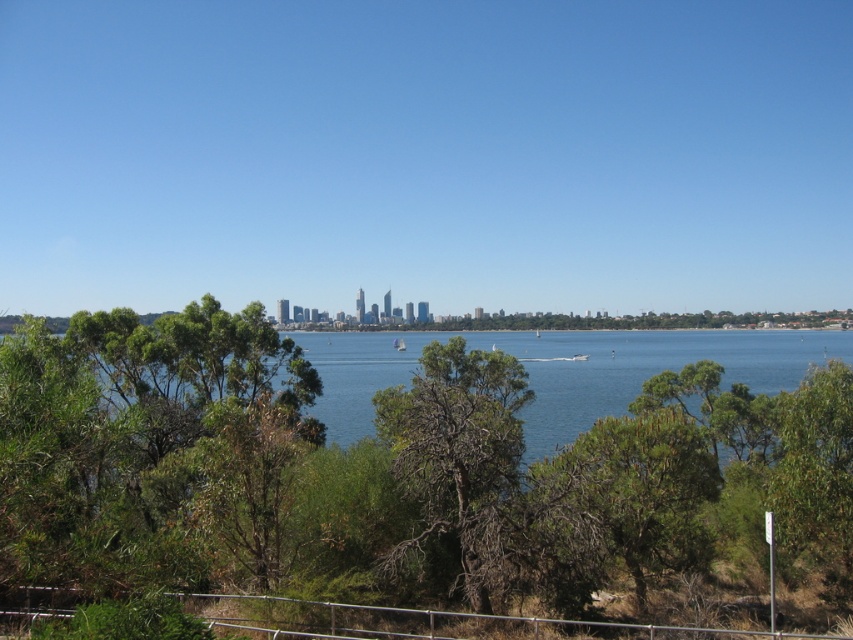
Question: Can you confirm if green leafy tree at center is bigger than brown/dry wood tree at center?

Choices:
 (A) no
 (B) yes

Answer: (B)

Question: Can you confirm if blue water at center is positioned to the right of brown/dry wood tree at center?

Choices:
 (A) no
 (B) yes

Answer: (A)

Question: Is blue water at center wider than green textured tree at center?

Choices:
 (A) yes
 (B) no

Answer: (A)

Question: Which point appears farthest from the camera in this image?

Choices:
 (A) (105, 544)
 (B) (602, 518)
 (C) (500, 472)

Answer: (B)

Question: Which object is closer to the camera taking this photo?

Choices:
 (A) blue water at center
 (B) green leafy tree at center
 (C) brown/dry wood tree at center

Answer: (B)

Question: Which object is farther from the camera taking this photo?

Choices:
 (A) blue water at center
 (B) brown/dry wood tree at center
 (C) green leafy tree at center
 (D) green textured tree at center

Answer: (A)